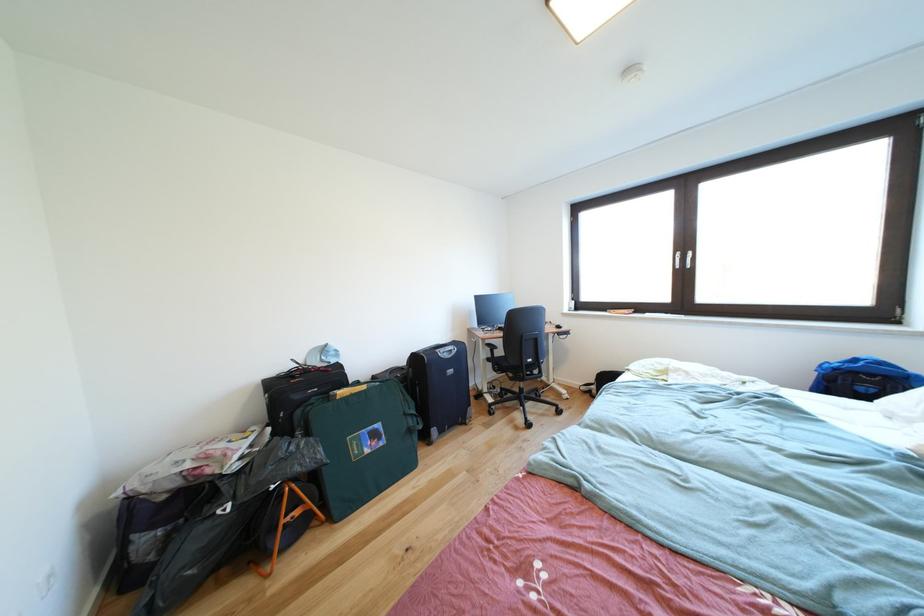
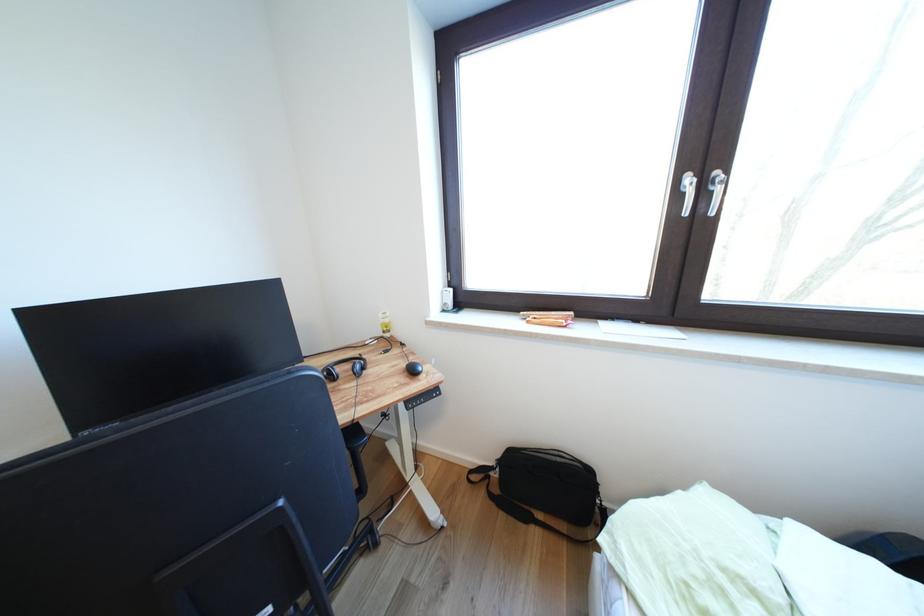
The images are taken continuously from a first-person perspective. In which direction are you moving?

The movement direction of the cameraman is right, forward.